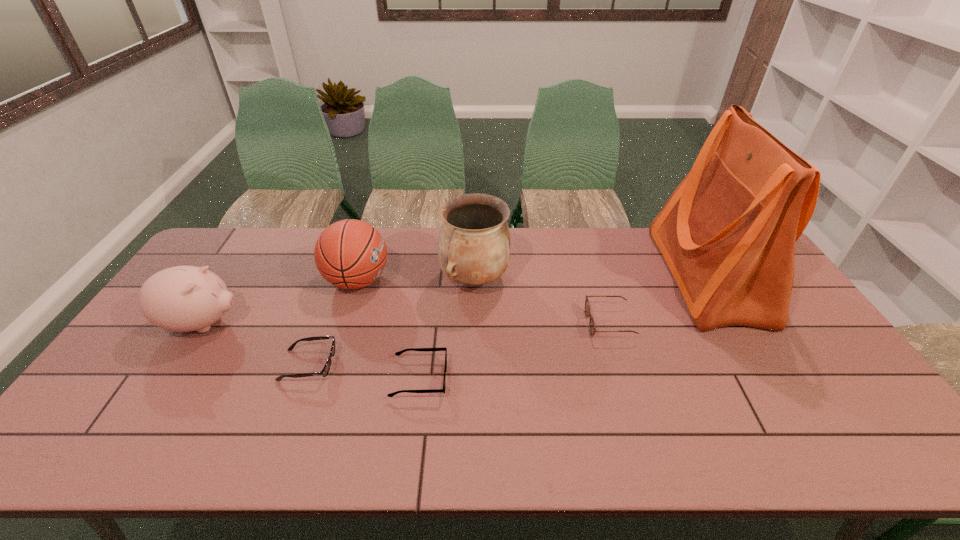
Locate which object ranks fifth in proximity to the rightmost object. Please provide its 2D coordinates. Your answer should be formatted as a tuple, i.e. [(x, y)], where the tuple contains the x and y coordinates of a point satisfying the conditions above.

[(326, 369)]

Identify the location of object identified as the second closest to the rightmost spectacles. (473, 245).

I want to click on spectacles that stands as the second closest to the basketball, so click(399, 353).

In order to click on spectacles object that ranks as the closest to the second tallest object in this screenshot , I will do [399, 353].

Where is `vacant space that satisfies the following two spatial constraints: 1. on the front side of the urn; 2. at the snout of the piggy bank`? This screenshot has width=960, height=540. vacant space that satisfies the following two spatial constraints: 1. on the front side of the urn; 2. at the snout of the piggy bank is located at coordinates (473, 323).